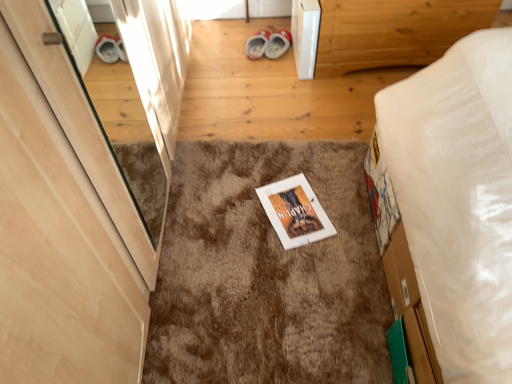
Question: Could you tell me if red suede shoes at center is turned towards light wood door at left?

Choices:
 (A) yes
 (B) no

Answer: (A)

Question: From a real-world perspective, does red suede shoes at center stand above light wood door at left?

Choices:
 (A) yes
 (B) no

Answer: (B)

Question: Is red suede shoes at center further to camera compared to light wood door at left?

Choices:
 (A) yes
 (B) no

Answer: (A)

Question: Is red suede shoes at center shorter than light wood door at left?

Choices:
 (A) yes
 (B) no

Answer: (A)

Question: Can we say red suede shoes at center lies outside light wood door at left?

Choices:
 (A) yes
 (B) no

Answer: (A)

Question: Can you confirm if red suede shoes at center is taller than light wood door at left?

Choices:
 (A) no
 (B) yes

Answer: (A)

Question: Considering the relative sizes of wooden bed frame at upper right and red suede shoes at center in the image provided, is wooden bed frame at upper right bigger than red suede shoes at center?

Choices:
 (A) yes
 (B) no

Answer: (A)

Question: Is the surface of wooden bed frame at upper right in direct contact with red suede shoes at center?

Choices:
 (A) no
 (B) yes

Answer: (A)

Question: Can you confirm if wooden bed frame at upper right is taller than red suede shoes at center?

Choices:
 (A) no
 (B) yes

Answer: (B)

Question: Is wooden bed frame at upper right closer to the viewer compared to red suede shoes at center?

Choices:
 (A) yes
 (B) no

Answer: (A)

Question: Can you confirm if wooden bed frame at upper right is shorter than red suede shoes at center?

Choices:
 (A) yes
 (B) no

Answer: (B)

Question: Is wooden bed frame at upper right oriented away from red suede shoes at center?

Choices:
 (A) no
 (B) yes

Answer: (A)

Question: From the image's perspective, is brown shaggy carpet at center on red suede shoes at center?

Choices:
 (A) yes
 (B) no

Answer: (B)